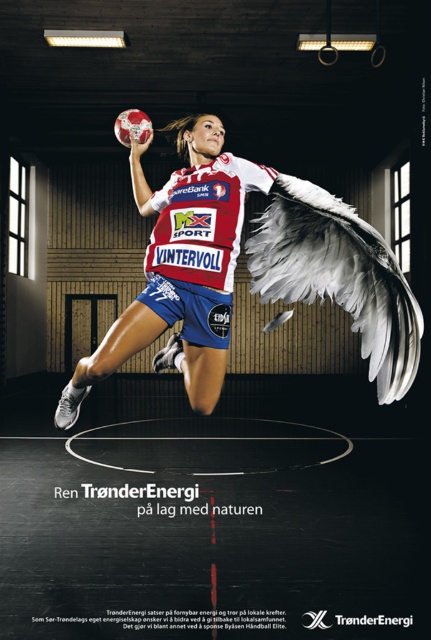
Question: Which point is closer to the camera taking this photo?

Choices:
 (A) (386, 396)
 (B) (172, 259)
 (C) (262, 260)

Answer: (A)

Question: Can you confirm if matte white jersey at center is thinner than white jersey at center?

Choices:
 (A) yes
 (B) no

Answer: (B)

Question: Does matte white jersey at center have a greater width compared to white feathered wing at upper center?

Choices:
 (A) no
 (B) yes

Answer: (B)

Question: Is matte white jersey at center below white jersey at center?

Choices:
 (A) yes
 (B) no

Answer: (A)

Question: Which of these objects is positioned closest to the white feathered wing at upper center?

Choices:
 (A) white jersey at center
 (B) matte white jersey at center

Answer: (B)

Question: Which point is closer to the camera taking this photo?

Choices:
 (A) (356, 216)
 (B) (239, 237)

Answer: (B)